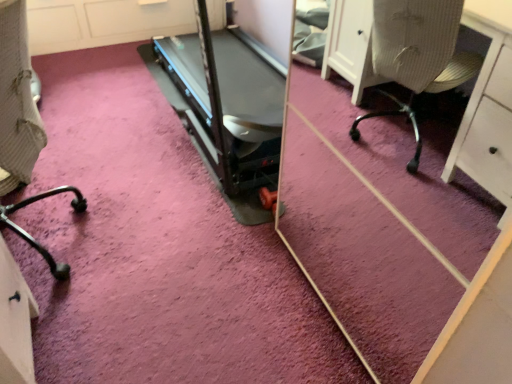
Question: Could you tell me if black metal chair leg at lower left is turned towards black plastic treadmill at center?

Choices:
 (A) no
 (B) yes

Answer: (A)

Question: Is black plastic treadmill at center at the back of black metal chair leg at lower left?

Choices:
 (A) no
 (B) yes

Answer: (A)

Question: Is black metal chair leg at lower left wider than black plastic treadmill at center?

Choices:
 (A) yes
 (B) no

Answer: (B)

Question: From the image's perspective, is black metal chair leg at lower left on top of black plastic treadmill at center?

Choices:
 (A) yes
 (B) no

Answer: (B)

Question: Can you confirm if black metal chair leg at lower left is shorter than black plastic treadmill at center?

Choices:
 (A) yes
 (B) no

Answer: (B)

Question: Is black metal chair leg at lower left positioned behind black plastic treadmill at center?

Choices:
 (A) no
 (B) yes

Answer: (A)

Question: From a real-world perspective, is black plastic treadmill at center physically above black metal chair leg at lower left?

Choices:
 (A) no
 (B) yes

Answer: (A)

Question: From the image's perspective, is black plastic treadmill at center above black metal chair leg at lower left?

Choices:
 (A) yes
 (B) no

Answer: (A)

Question: Does black plastic treadmill at center have a lesser width compared to black metal chair leg at lower left?

Choices:
 (A) no
 (B) yes

Answer: (A)

Question: Is black plastic treadmill at center oriented away from black metal chair leg at lower left?

Choices:
 (A) yes
 (B) no

Answer: (B)

Question: Can you confirm if black plastic treadmill at center is smaller than black metal chair leg at lower left?

Choices:
 (A) no
 (B) yes

Answer: (A)

Question: Does black plastic treadmill at center lie behind black metal chair leg at lower left?

Choices:
 (A) no
 (B) yes

Answer: (B)

Question: In terms of height, does black metal chair leg at lower left look taller or shorter compared to black plastic treadmill at center?

Choices:
 (A) tall
 (B) short

Answer: (A)